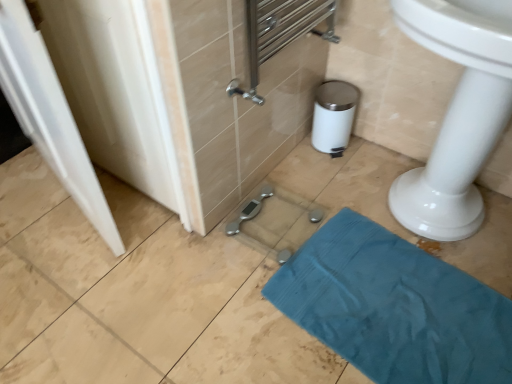
At what (x,y) coordinates should I click in order to perform the action: click on white glossy door at left. Please return your answer as a coordinate pair (x, y). Looking at the image, I should click on (49, 116).

Describe the element at coordinates (49, 116) in the screenshot. The height and width of the screenshot is (384, 512). I see `white glossy door at left` at that location.

From the picture: Measure the distance between teal fabric towel at lower right and camera.

The distance of teal fabric towel at lower right from camera is 1.21 meters.

In the scene shown: In order to face teal fabric towel at lower right, should I rotate leftwards or rightwards?

To face it directly, rotate right by 18.214 degrees.

The width and height of the screenshot is (512, 384). Describe the element at coordinates (394, 307) in the screenshot. I see `teal fabric towel at lower right` at that location.

The image size is (512, 384). Identify the location of teal fabric towel at lower right. (394, 307).

Find the location of `white glossy door at left`. white glossy door at left is located at coordinates (49, 116).

Which is more to the right, white glossy door at left or teal fabric towel at lower right?

From the viewer's perspective, teal fabric towel at lower right appears more on the right side.

Between white glossy door at left and teal fabric towel at lower right, which one is positioned in front?

white glossy door at left is more forward.

Is point (31, 132) positioned behind point (442, 373)?

Yes, point (31, 132) is farther from viewer.

From the image's perspective, is white glossy door at left beneath teal fabric towel at lower right?

No, from the image's perspective, white glossy door at left is not beneath teal fabric towel at lower right.

From a real-world perspective, does white glossy door at left sit lower than teal fabric towel at lower right?

No, from a real-world perspective, white glossy door at left is not below teal fabric towel at lower right.

Is white glossy door at left wider or thinner than teal fabric towel at lower right?

Clearly, white glossy door at left has less width compared to teal fabric towel at lower right.

Which of these two, white glossy door at left or teal fabric towel at lower right, stands taller?

white glossy door at left.

Who is smaller, white glossy door at left or teal fabric towel at lower right?

With smaller size is teal fabric towel at lower right.

In the scene shown: Is teal fabric towel at lower right a part of white glossy door at left?

No, teal fabric towel at lower right is located outside of white glossy door at left.

Are white glossy door at left and teal fabric towel at lower right far apart?

No.

Based on the photo, does white glossy door at left turn towards teal fabric towel at lower right?

No, white glossy door at left is not aimed at teal fabric towel at lower right.

How different are the orientations of white glossy door at left and teal fabric towel at lower right in degrees?

They differ by 10.8 degrees in their facing directions.

The height and width of the screenshot is (384, 512). In order to click on bath towel below the white glossy door at left (from a real-world perspective) in this screenshot , I will do `click(394, 307)`.

Does teal fabric towel at lower right appear on the right side of white glossy door at left?

Yes, teal fabric towel at lower right is to the right of white glossy door at left.

Which object is further away from the camera, teal fabric towel at lower right or white glossy door at left?

Positioned behind is teal fabric towel at lower right.

Which is farther, (x=437, y=354) or (x=44, y=123)?

Point (x=437, y=354)

From the image's perspective, would you say teal fabric towel at lower right is shown under white glossy door at left?

Yes.

From a real-world perspective, is teal fabric towel at lower right physically above white glossy door at left?

No, from a real-world perspective, teal fabric towel at lower right is not over white glossy door at left

Between teal fabric towel at lower right and white glossy door at left, which one has larger width?

teal fabric towel at lower right is wider.

Which of these two, teal fabric towel at lower right or white glossy door at left, stands shorter?

Standing shorter between the two is teal fabric towel at lower right.

Based on the photo, who is smaller, teal fabric towel at lower right or white glossy door at left?

teal fabric towel at lower right.

Would you say teal fabric towel at lower right contains white glossy door at left?

Definitely not — white glossy door at left is not inside teal fabric towel at lower right.

Would you say teal fabric towel at lower right is a long distance from white glossy door at left?

No, teal fabric towel at lower right is in close proximity to white glossy door at left.

Could you tell me if teal fabric towel at lower right is facing white glossy door at left?

No, teal fabric towel at lower right does not turn towards white glossy door at left.

Can you tell me how much teal fabric towel at lower right and white glossy door at left differ in facing direction?

The angle between the facing direction of teal fabric towel at lower right and the facing direction of white glossy door at left is 10.8 degrees.

This screenshot has width=512, height=384. In the image, there is a teal fabric towel at lower right. In order to click on screen door above it (from the image's perspective) in this screenshot , I will do `click(49, 116)`.

Locate an element on the screen. This screenshot has height=384, width=512. bath towel that appears below the white glossy door at left (from a real-world perspective) is located at coordinates (394, 307).

In order to click on bath towel behind the white glossy door at left in this screenshot , I will do `click(394, 307)`.